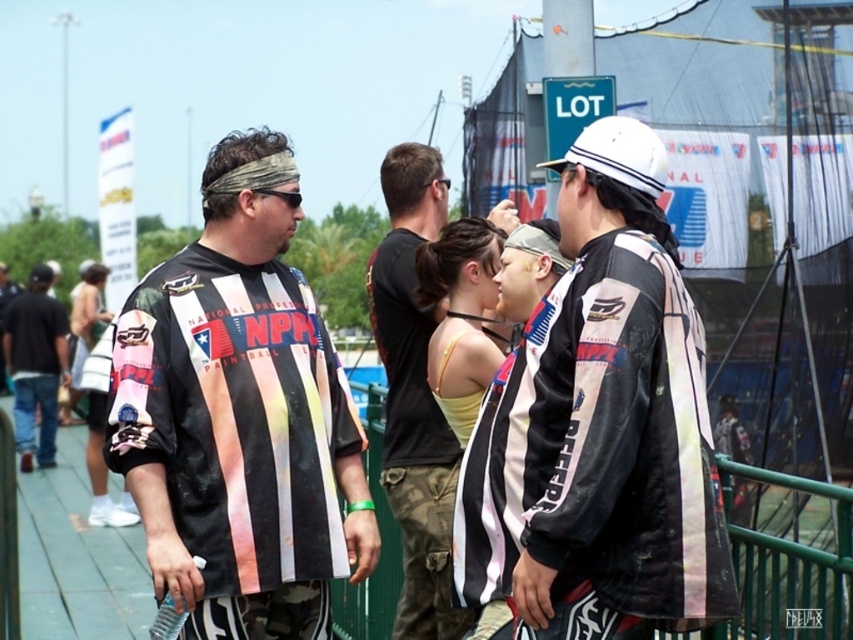
Is point (482, 353) farther from camera compared to point (86, 305)?

No, it is in front of (86, 305).

Which is in front, point (486, 365) or point (93, 472)?

Positioned in front is point (486, 365).

Does point (444, 364) come closer to viewer compared to point (91, 465)?

Yes.

Image resolution: width=853 pixels, height=640 pixels. In order to click on yellow fabric top at center in this screenshot , I will do `click(461, 316)`.

What do you see at coordinates (415, 396) in the screenshot? This screenshot has width=853, height=640. I see `camouflage pants at center` at bounding box center [415, 396].

Which is more to the right, camouflage pants at center or matte black jacket at center?

matte black jacket at center

The height and width of the screenshot is (640, 853). Identify the location of camouflage pants at center. (415, 396).

You are a GUI agent. You are given a task and a screenshot of the screen. Output one action in this format:
    pyautogui.click(x=<x>, y=<y>)
    Task: Click on the camouflage pants at center
    Image resolution: width=853 pixels, height=640 pixels.
    Given the screenshot: What is the action you would take?
    pyautogui.click(x=415, y=396)

The height and width of the screenshot is (640, 853). Describe the element at coordinates (461, 316) in the screenshot. I see `yellow fabric top at center` at that location.

Locate an element on the screen. yellow fabric top at center is located at coordinates (461, 316).